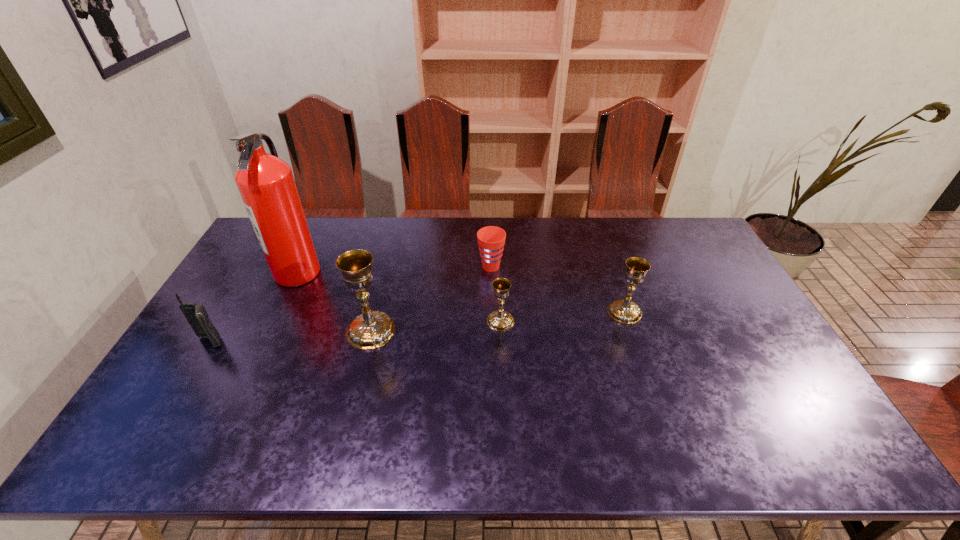
You are a GUI agent. You are given a task and a screenshot of the screen. Output one action in this format:
    pyautogui.click(x=<x>, y=<y>)
    Task: Click on the free space between the fifth object from right to left and the shortest chalice
    
    Given the screenshot: What is the action you would take?
    pyautogui.click(x=399, y=296)

Find the location of a particular element. object identified as the closest to the rightmost chalice is located at coordinates (500, 320).

The image size is (960, 540). I want to click on object that is the fourth closest one to the tallest object, so click(500, 320).

Locate which chalice ranks third in proximity to the cup. Please provide its 2D coordinates. Your answer should be formatted as a tuple, i.e. [(x, y)], where the tuple contains the x and y coordinates of a point satisfying the conditions above.

[(624, 311)]

Find the location of `chalice that is the third closest to the cup`. chalice that is the third closest to the cup is located at coordinates (624, 311).

Locate an element on the screen. vacant space that satisfies the following two spatial constraints: 1. at the nozzle of the tallest object; 2. on the back side of the shortest chalice is located at coordinates (274, 321).

Where is `blank space that satisfies the following two spatial constraints: 1. on the back side of the rightmost chalice; 2. on the right side of the leftmost chalice`? The image size is (960, 540). blank space that satisfies the following two spatial constraints: 1. on the back side of the rightmost chalice; 2. on the right side of the leftmost chalice is located at coordinates (375, 312).

In order to click on vacant point that satisfies the following two spatial constraints: 1. at the nozzle of the second shortest chalice; 2. on the right side of the second object from left to right in this screenshot , I will do `click(278, 312)`.

Where is `vacant space that satisfies the following two spatial constraints: 1. at the nozzle of the second tallest object; 2. on the left side of the tallest object`? The height and width of the screenshot is (540, 960). vacant space that satisfies the following two spatial constraints: 1. at the nozzle of the second tallest object; 2. on the left side of the tallest object is located at coordinates (270, 330).

Find the location of `vacant space that satisfies the following two spatial constraints: 1. at the nozzle of the second object from left to right; 2. on the back side of the shortest chalice`. vacant space that satisfies the following two spatial constraints: 1. at the nozzle of the second object from left to right; 2. on the back side of the shortest chalice is located at coordinates (274, 321).